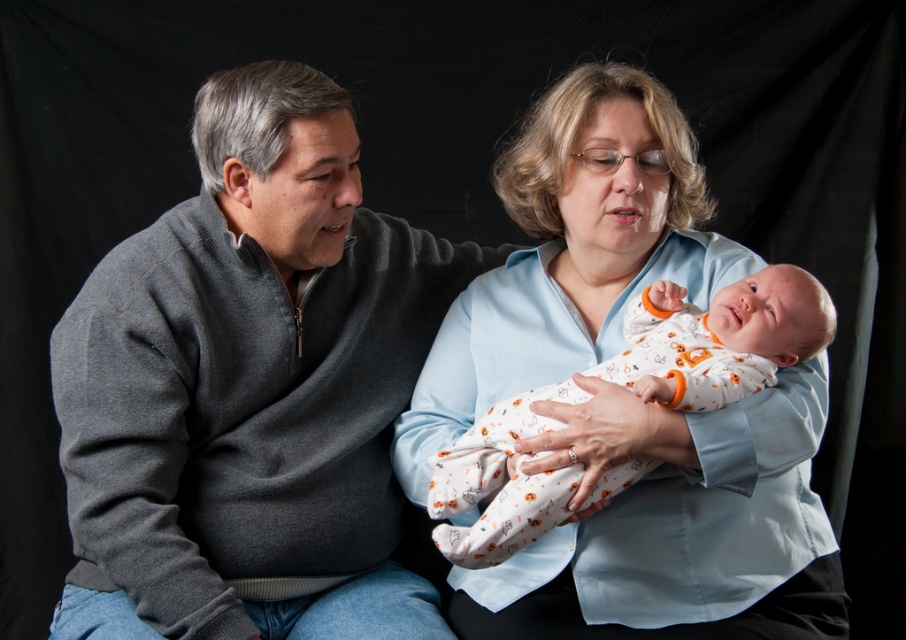
You are a photographer adjusting the focus on your camera. The gray sweater at left and the light blue shirt at center are both in the frame. If the camera can only focus on objects within a 10 inch range, will both items be in focus?

The gray sweater at left is 12.86 inches away from the light blue shirt at center. Since the distance between them is greater than 10 inches, the camera cannot focus on both items simultaneously.

You are a photographer adjusting the focus on your camera. You notice two points in the image at coordinates point (320, 394) and point (657, 394). Which point should you focus on to ensure the subject closest to the viewer is sharp?

You should focus on point (320, 394) because it is closer to the viewer than point (657, 394) according to the description.

You are a photographer taking a portrait of the light blue shirt at center and the white cotton onesie at center. Which object appears taller in the photo?

The light blue shirt at center appears taller than the white cotton onesie at center in the photo.